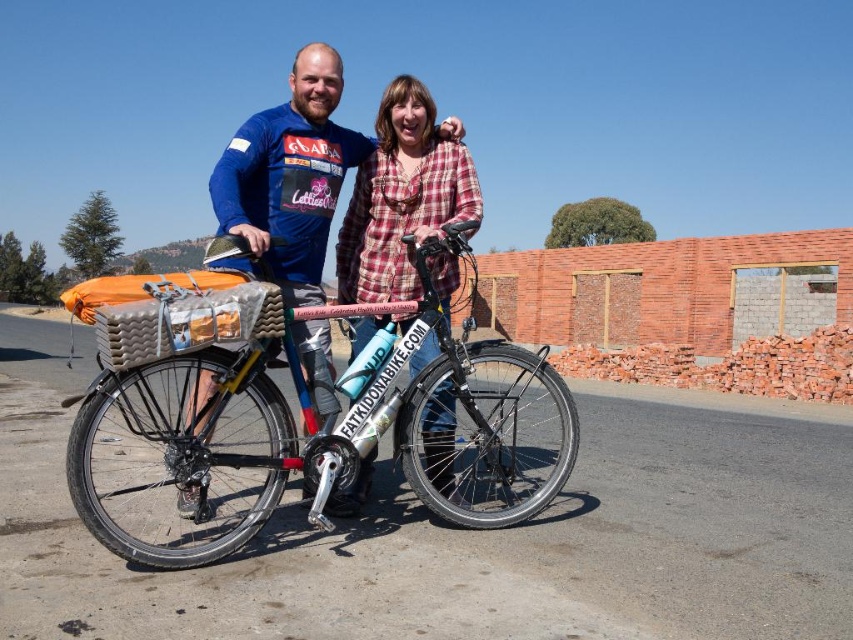
Can you confirm if brushed metal bicycle at center is positioned to the right of plaid fabric shirt at center?

Incorrect, brushed metal bicycle at center is not on the right side of plaid fabric shirt at center.

Is brushed metal bicycle at center above plaid fabric shirt at center?

Indeed, brushed metal bicycle at center is positioned over plaid fabric shirt at center.

What are the coordinates of `brushed metal bicycle at center` in the screenshot? It's located at (288, 177).

Measure the distance from silver metallic bicycle at center to plaid fabric shirt at center.

silver metallic bicycle at center is 9.16 feet away from plaid fabric shirt at center.

This screenshot has width=853, height=640. What do you see at coordinates (305, 406) in the screenshot?
I see `silver metallic bicycle at center` at bounding box center [305, 406].

Find the location of `silver metallic bicycle at center`. silver metallic bicycle at center is located at coordinates (305, 406).

Is silver metallic bicycle at center closer to the viewer compared to brushed metal bicycle at center?

No, it is behind brushed metal bicycle at center.

Find the location of a particular element. silver metallic bicycle at center is located at coordinates (305, 406).